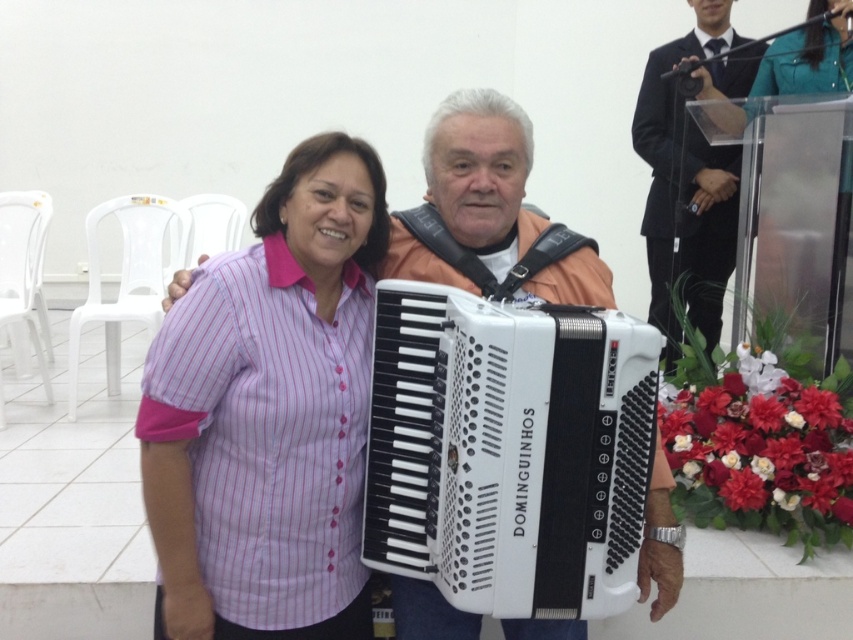
Question: Is pink striped shirt at center smaller than teal fabric dress at upper right?

Choices:
 (A) no
 (B) yes

Answer: (B)

Question: Estimate the real-world distances between objects in this image. Which object is farther from the black suit at upper right?

Choices:
 (A) teal fabric dress at upper right
 (B) white plastic accordion at center
 (C) pink striped shirt at center

Answer: (C)

Question: Does white plastic accordion at center appear on the right side of black suit at upper right?

Choices:
 (A) yes
 (B) no

Answer: (B)

Question: Considering the relative positions of white plastic accordion at center and teal fabric dress at upper right in the image provided, where is white plastic accordion at center located with respect to teal fabric dress at upper right?

Choices:
 (A) above
 (B) below

Answer: (B)

Question: Which is nearer to the white plastic accordion at center?

Choices:
 (A) pink striped shirt at center
 (B) teal fabric dress at upper right

Answer: (A)

Question: Which of the following is the closest to the observer?

Choices:
 (A) (814, 13)
 (B) (460, 344)

Answer: (B)